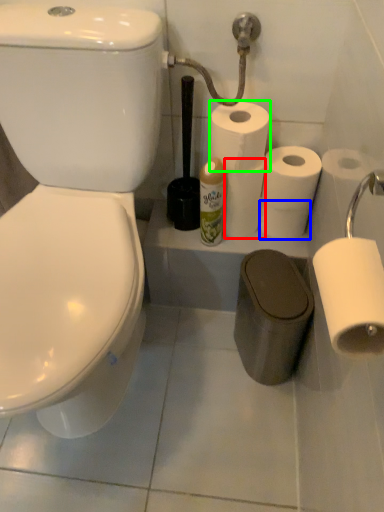
Question: Which object is positioned farthest from toilet paper (highlighted by a red box)? Select from toilet paper (highlighted by a blue box) and toilet paper (highlighted by a green box).

Choices:
 (A) toilet paper
 (B) toilet paper

Answer: (B)